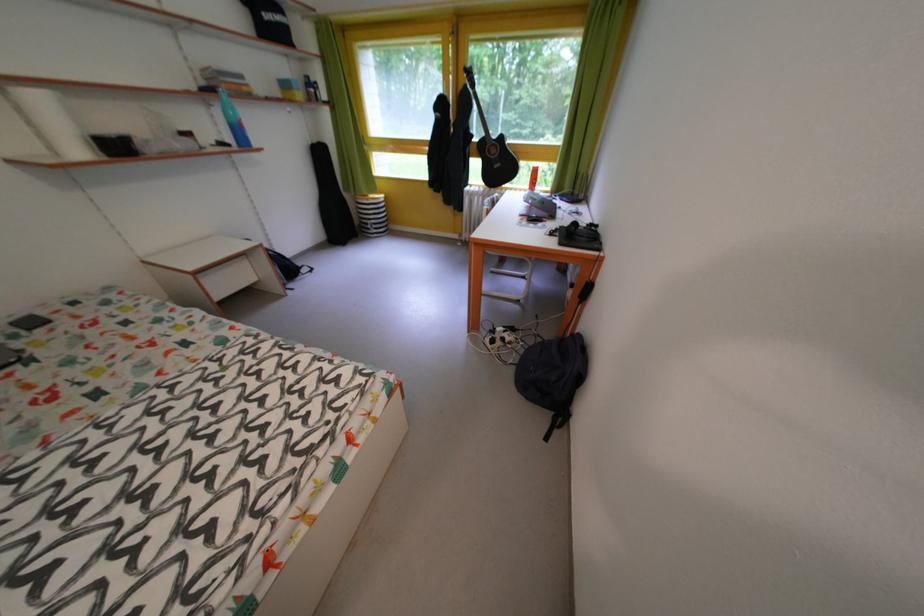
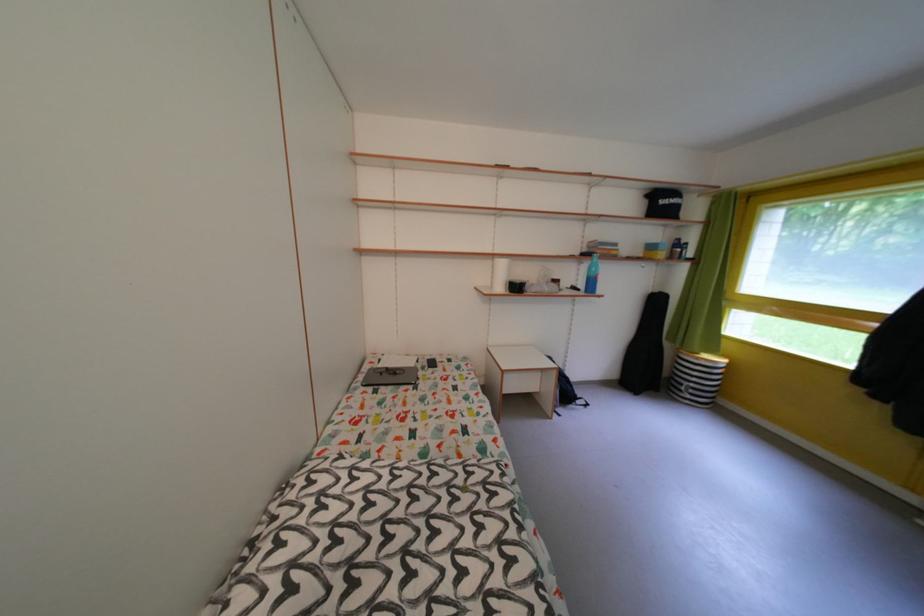
Where in the second image is the point corresponding to (x=324, y=147) from the first image?

(665, 296)